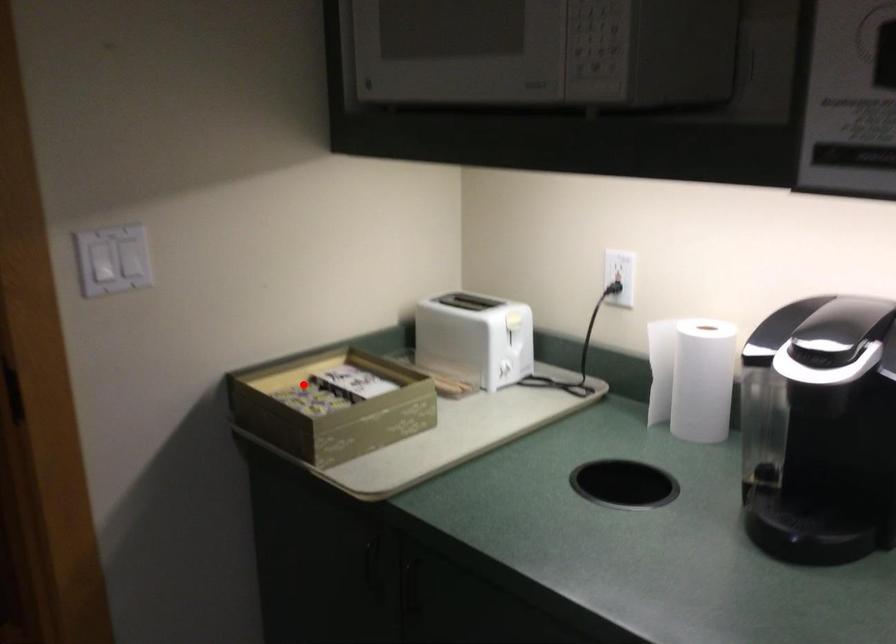
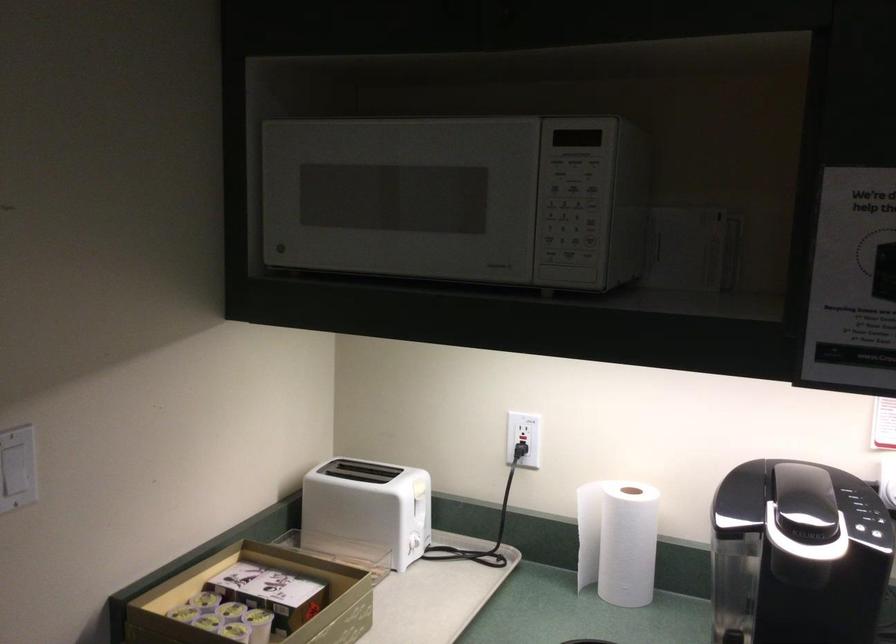
Where in the second image is the point corresponding to the highlighted location from the first image?

(204, 597)